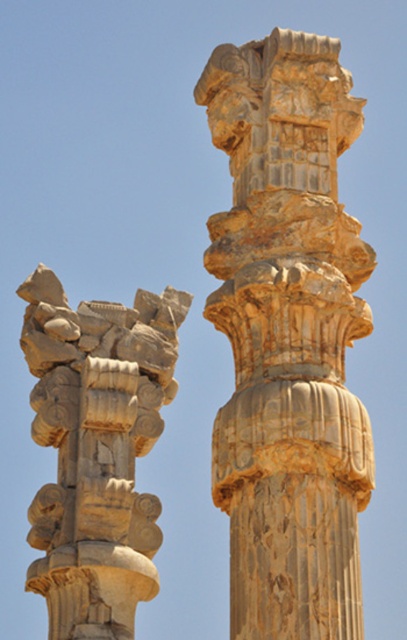
You are standing in front of two ancient stone columns. The columns are labeled as point (326, 538). Which column is closer to you?

The point (326, 538) is 63.18 meters away from the viewer, so the column labeled as point (326, 538) is farther away from you since it has a greater distance measurement.

Based on the scene description, where is the golden stone column at center located in terms of coordinates?

The golden stone column at center is located at coordinates point (288, 337).